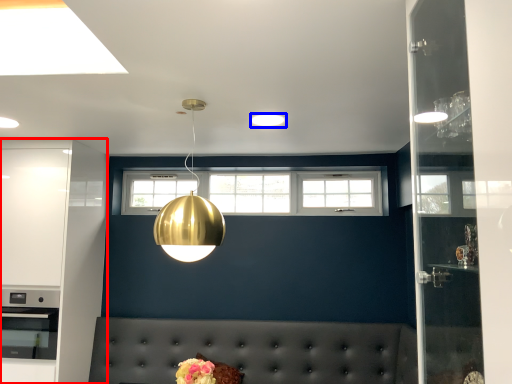
Question: Which object appears farthest to the camera in this image, cabinetry (highlighted by a red box) or lighting (highlighted by a blue box)?

Choices:
 (A) cabinetry
 (B) lighting

Answer: (A)